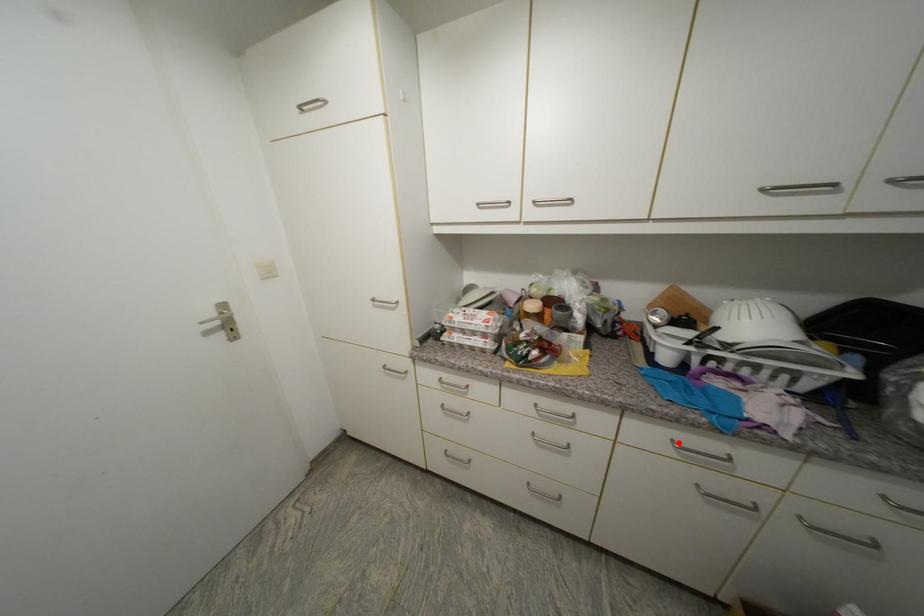
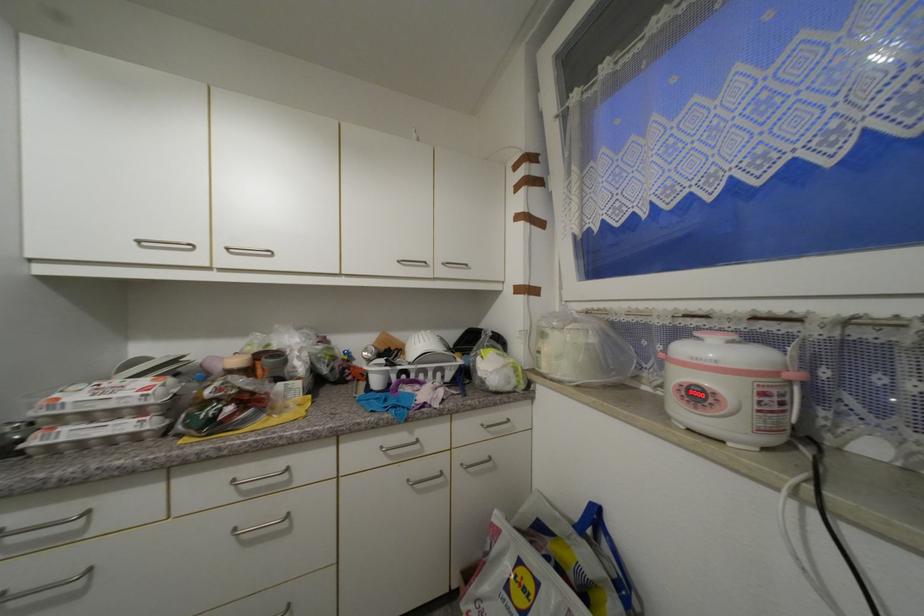
Locate, in the second image, the point that corresponds to the highlighted location in the first image.

(387, 448)